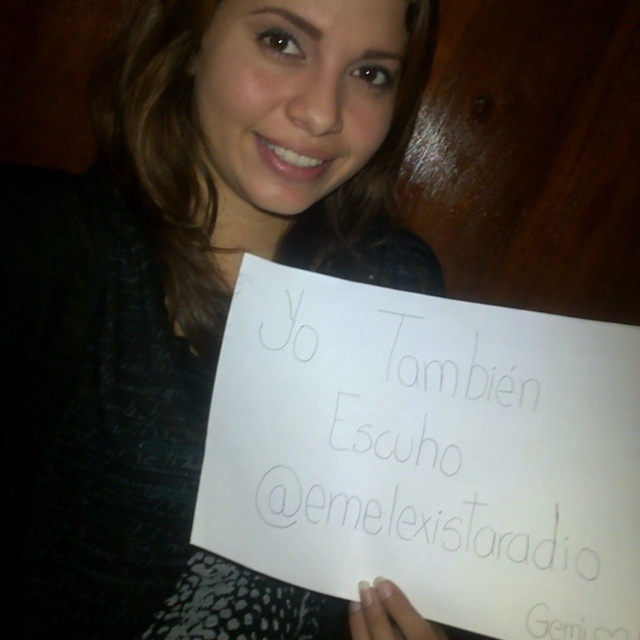
Question: Which object is farther from the camera taking this photo?

Choices:
 (A) matte black paper at center
 (B) white paper at center

Answer: (B)

Question: Can you confirm if matte black paper at center is thinner than white paper at center?

Choices:
 (A) no
 (B) yes

Answer: (A)

Question: Which point is closer to the camera?

Choices:
 (A) (333, 470)
 (B) (420, 61)

Answer: (A)

Question: Is matte black paper at center thinner than white paper at center?

Choices:
 (A) no
 (B) yes

Answer: (A)

Question: Observing the image, what is the correct spatial positioning of matte black paper at center in reference to white paper at center?

Choices:
 (A) left
 (B) right

Answer: (A)